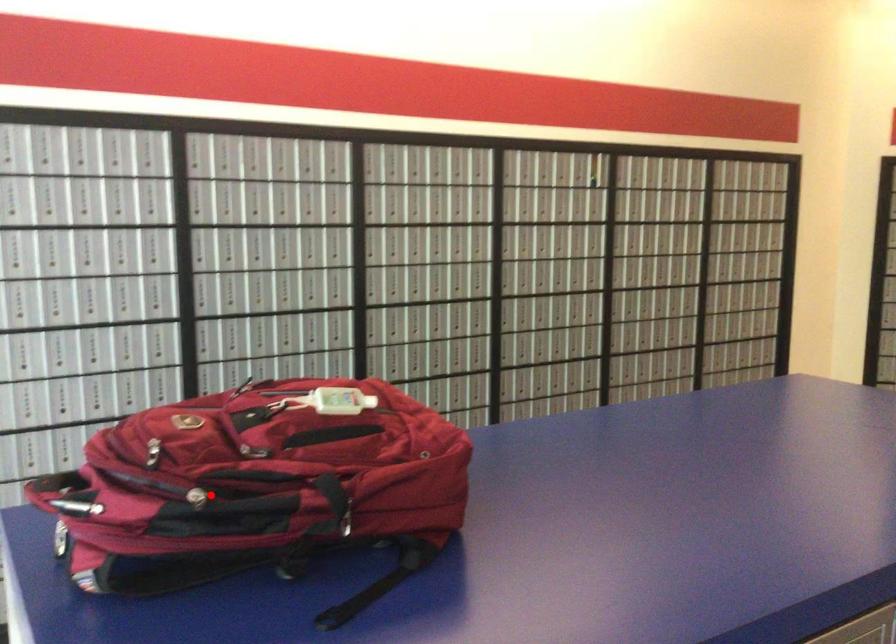
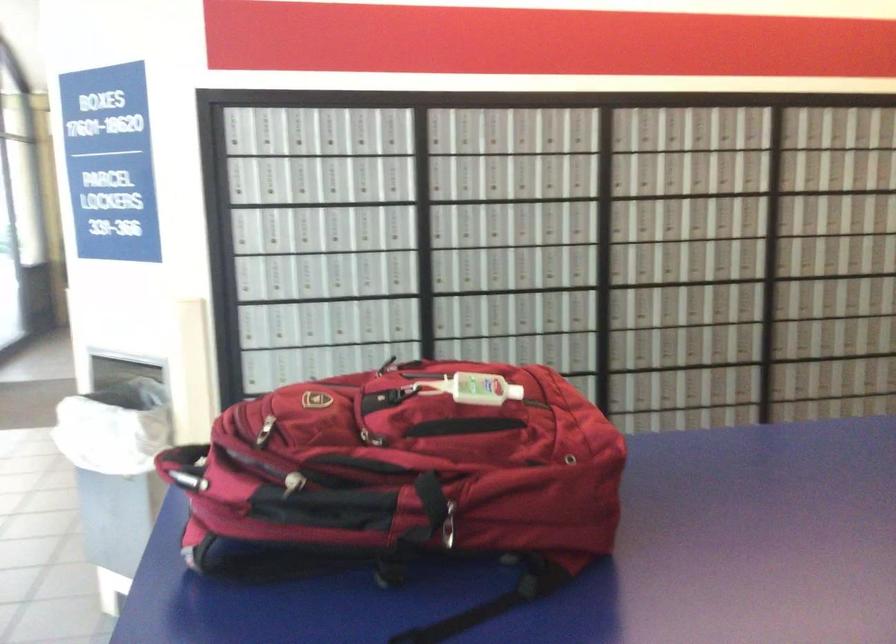
Question: I am providing you with two images of the same scene from different viewpoints. In image1, a red point is highlighted. Considering the same 3D point in image2, which of the following is correct?

Choices:
 (A) It is closer
 (B) It is farther

Answer: (A)